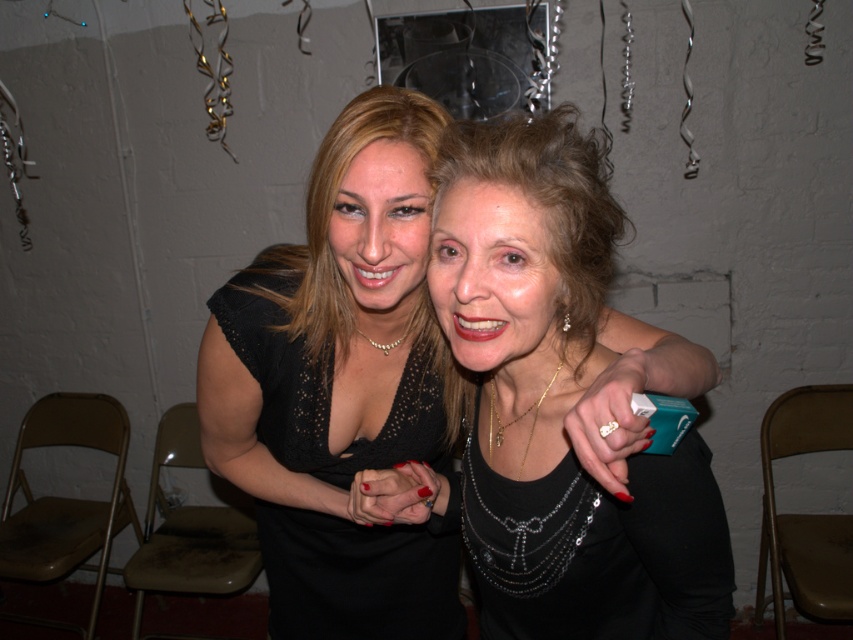
Does point (358, 608) come closer to viewer compared to point (410, 323)?

No.

Is point (254, 262) farther from viewer compared to point (386, 346)?

Yes, it is.

Find the location of a particular element. The height and width of the screenshot is (640, 853). black lace dress at center is located at coordinates (321, 378).

Is black satin dress at center thinner than black lace dress at center?

Incorrect, black satin dress at center's width is not less than black lace dress at center's.

Is black satin dress at center below black lace dress at center?

Incorrect, black satin dress at center is not positioned below black lace dress at center.

Find the location of a particular element. black satin dress at center is located at coordinates (341, 388).

Between black satin dress at center and pearl necklace at center, which one has less height?

pearl necklace at center

Between point (306, 547) and point (390, 342), which one is positioned behind?

Point (306, 547)

Where is `black satin dress at center`? This screenshot has width=853, height=640. black satin dress at center is located at coordinates (341, 388).